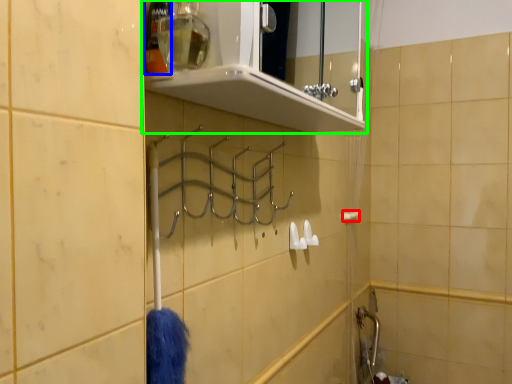
Question: Considering the real-world distances, which object is closest to towel bar (highlighted by a red box)? toiletry (highlighted by a blue box) or shelf (highlighted by a green box).

Choices:
 (A) toiletry
 (B) shelf

Answer: (B)